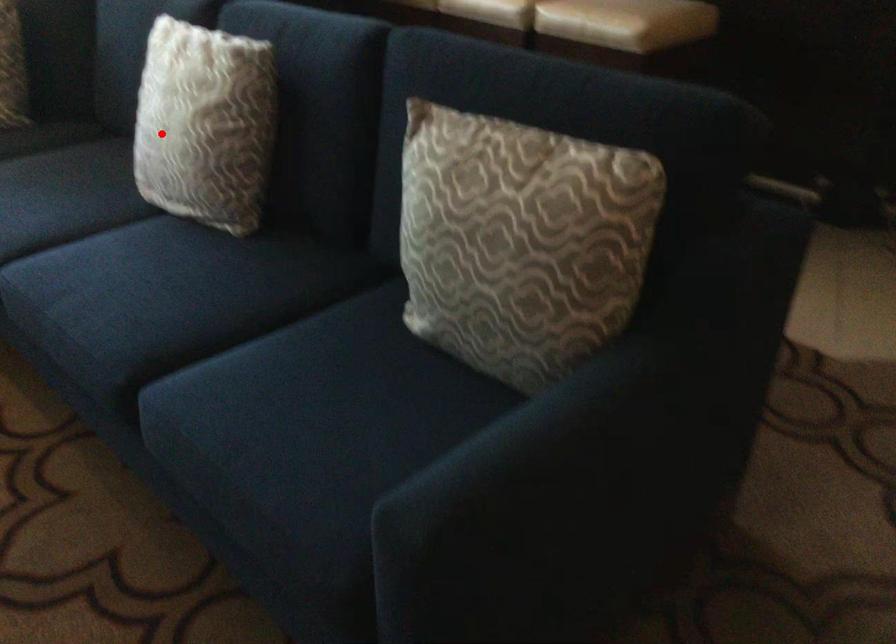
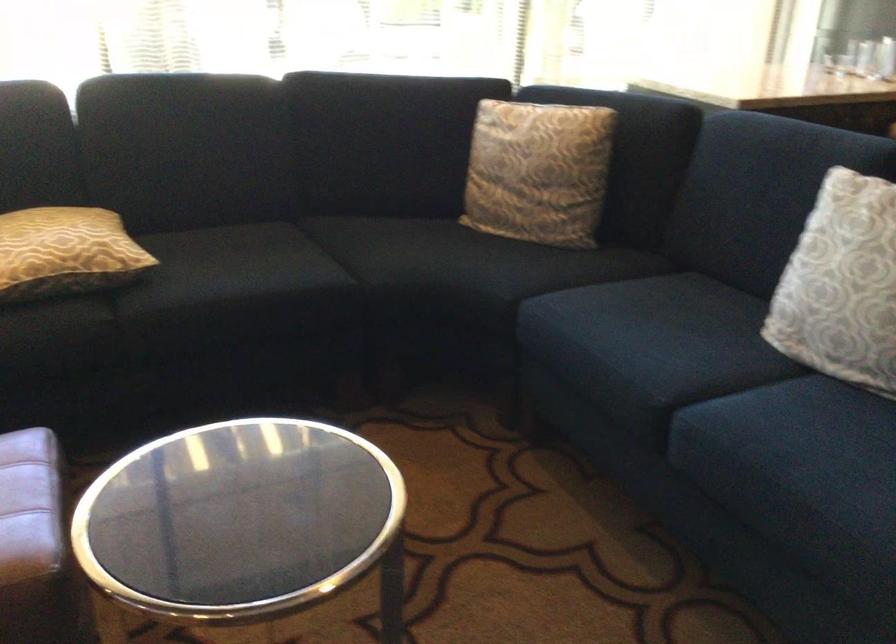
Where in the second image is the point corresponding to the highlighted location from the first image?

(841, 285)